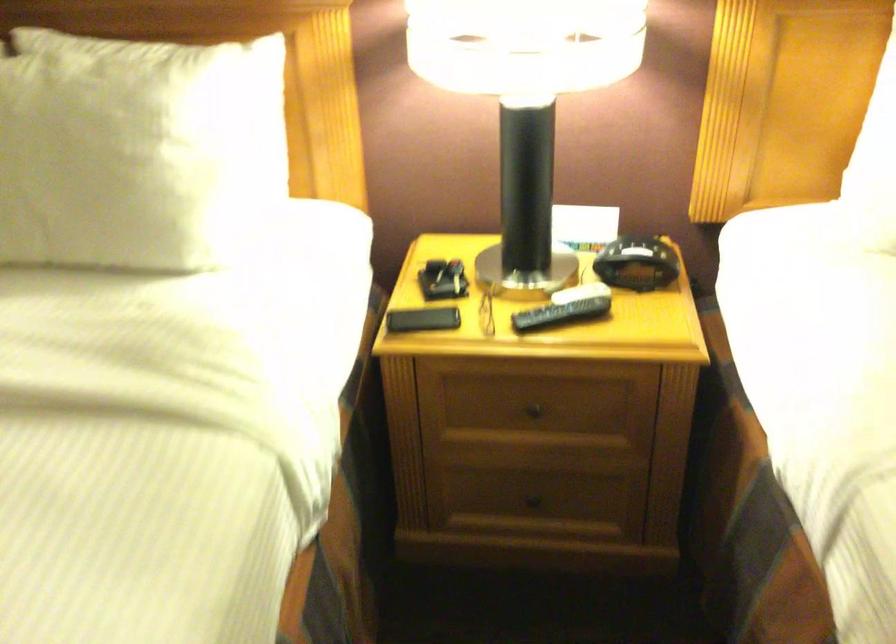
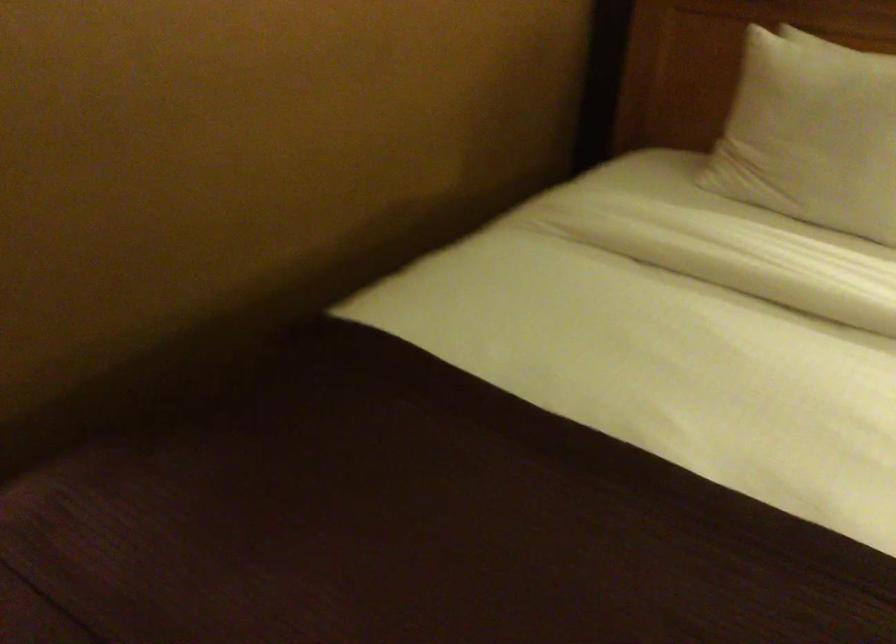
Question: The camera is either moving clockwise (left) or counter-clockwise (right) around the object. The first image is from the beginning of the video and the second image is from the end. Is the camera moving left or right when shooting the video?

Choices:
 (A) Left
 (B) Right

Answer: (B)